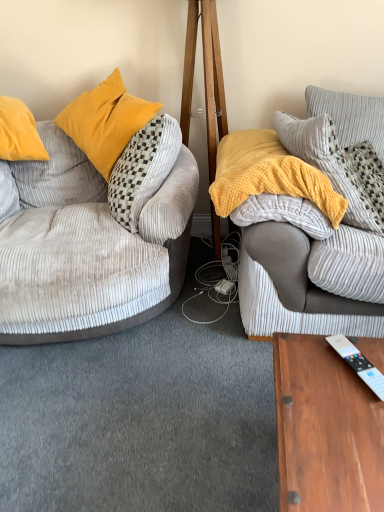
Question: From a real-world perspective, relative to velvet grey couch at left, which is the first studio couch from left to right, is white plastic remote control at lower right vertically above or below?

Choices:
 (A) above
 (B) below

Answer: (B)

Question: Would you say white plastic remote control at lower right is inside or outside velvet grey couch at left, the 2th studio couch in the right-to-left sequence?

Choices:
 (A) inside
 (B) outside

Answer: (B)

Question: Which of these objects is positioned closest to the white plastic remote control at lower right?

Choices:
 (A) yellow corduroy pillow at upper right, acting as the 2th pillow starting from the top
 (B) velvet grey couch at left, which is the first studio couch from left to right
 (C) yellow textured blanket at center
 (D) soft gray corduroy couch at right, the second studio couch from the left
 (E) corduroy pillow at upper right, the 1th pillow in the top-to-bottom sequence

Answer: (D)

Question: Estimate the real-world distances between objects in this image. Which object is farther from the corduroy pillow at upper right, the 1th pillow in the top-to-bottom sequence?

Choices:
 (A) yellow textured blanket at center
 (B) white plastic remote control at lower right
 (C) soft gray corduroy couch at right, marked as the 1th studio couch in a right-to-left arrangement
 (D) velvet grey couch at left, which is the first studio couch from left to right
 (E) yellow corduroy pillow at upper right, which is the 1th pillow in bottom-to-top order

Answer: (B)